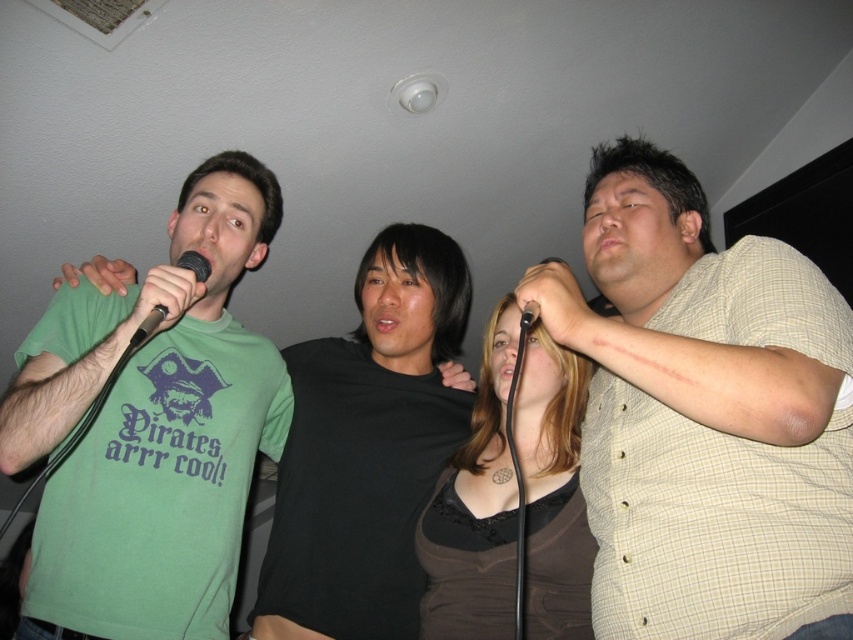
Question: Among these objects, which one is farthest from the camera?

Choices:
 (A) light beige checkered shirt at right
 (B) green matte t-shirt at left

Answer: (B)

Question: Is light beige checkered shirt at right to the right of green matte t-shirt at left from the viewer's perspective?

Choices:
 (A) no
 (B) yes

Answer: (B)

Question: Does light beige checkered shirt at right lie in front of black matte microphone at left?

Choices:
 (A) yes
 (B) no

Answer: (A)

Question: Does light beige checkered shirt at right come behind black matte microphone at center?

Choices:
 (A) no
 (B) yes

Answer: (A)

Question: Among these objects, which one is farthest from the camera?

Choices:
 (A) light beige checkered shirt at right
 (B) black matte microphone at left
 (C) green matte t-shirt at left
 (D) black matte microphone at upper center

Answer: (C)

Question: Estimate the real-world distances between objects in this image. Which object is farther from the black matte microphone at upper center?

Choices:
 (A) black matte microphone at center
 (B) black matte microphone at left

Answer: (B)